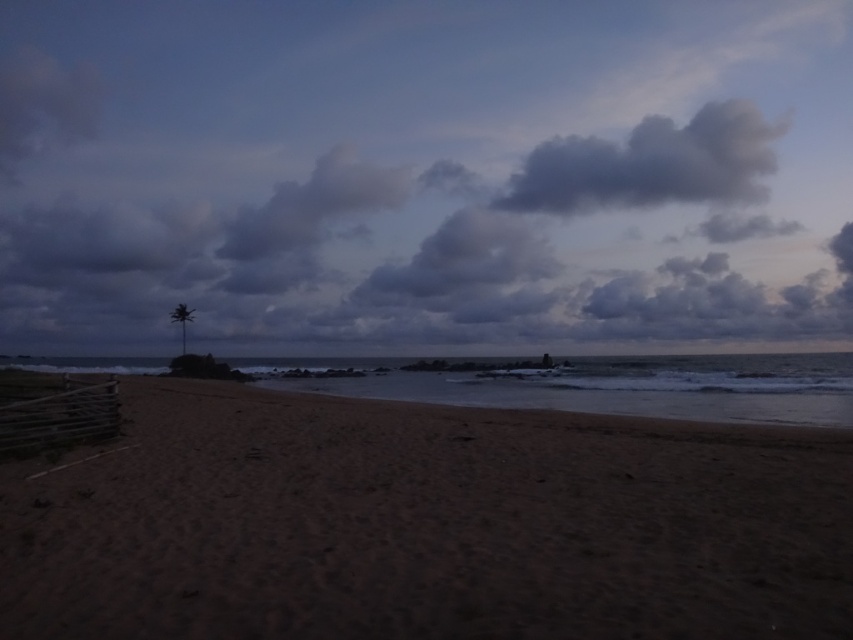
Consider the image. You are a photographer planning to capture the cloudy sky at upper center and the dark gray fluffy cloud at upper center in your shot. Which of the two has a greater width?

The cloudy sky at upper center has a greater width than the dark gray fluffy cloud at upper center, as stated in the description.

You are standing at the point with coordinates (619, 387) on the beach. What is the terrain like at that location?

The terrain at point (619, 387) is sandy water at center.

You are standing on the beach looking at the scene. There is a point marked at coordinates point (312, 204). What object is located at that point?

The point (312, 204) marks the location of the gray fluffy cloud at upper center.